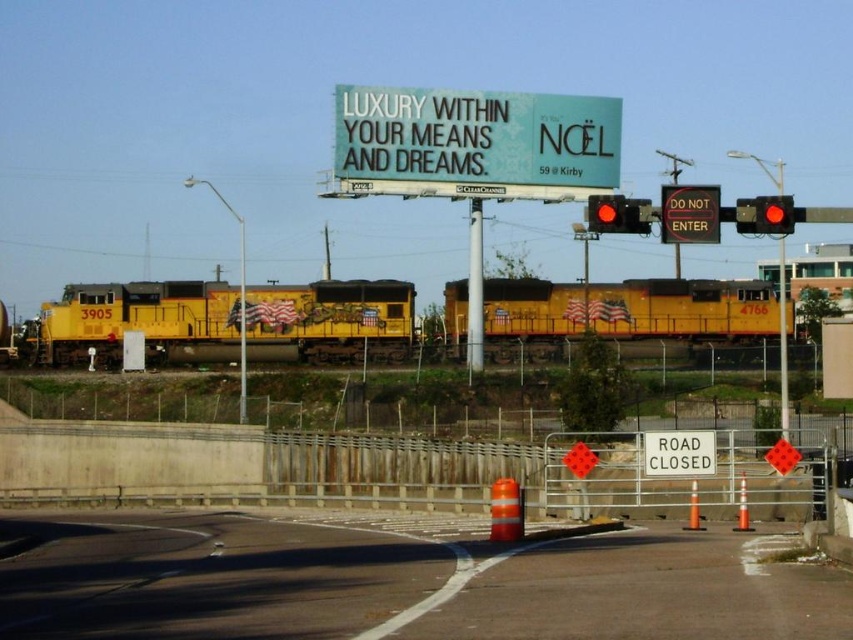
Can you confirm if metallic pole at center is wider than red glass traffic light at upper center?

In fact, metallic pole at center might be narrower than red glass traffic light at upper center.

Which is in front, point (469, 323) or point (601, 224)?

Point (601, 224)

Where is `metallic pole at center`? The height and width of the screenshot is (640, 853). metallic pole at center is located at coordinates (474, 289).

Does black plastic sign at upper center appear over red glass traffic light at upper right?

Incorrect, black plastic sign at upper center is not positioned above red glass traffic light at upper right.

Who is positioned more to the right, black plastic sign at upper center or red glass traffic light at upper right?

From the viewer's perspective, red glass traffic light at upper right appears more on the right side.

This screenshot has width=853, height=640. What do you see at coordinates (689, 212) in the screenshot?
I see `black plastic sign at upper center` at bounding box center [689, 212].

Find the location of a particular element. The height and width of the screenshot is (640, 853). black plastic sign at upper center is located at coordinates (689, 212).

Who is shorter, smooth asphalt road at center or metallic pole at center?

Standing shorter between the two is smooth asphalt road at center.

Does smooth asphalt road at center come behind metallic pole at center?

No, it is not.

Does point (740, 593) lie in front of point (469, 234)?

Yes, it is.

I want to click on smooth asphalt road at center, so click(x=399, y=580).